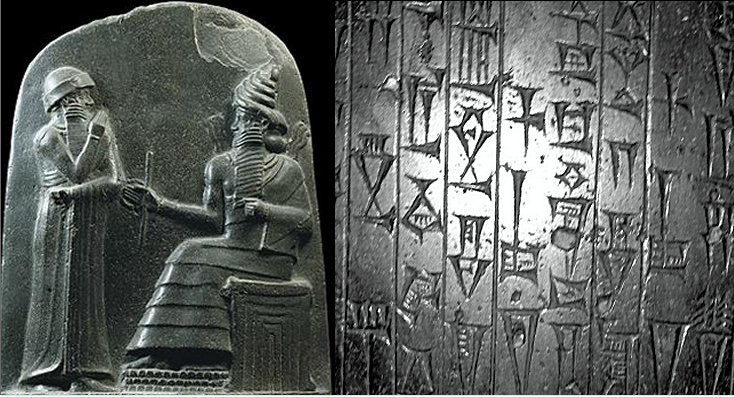
The image size is (734, 398). I want to click on something you sit on, so click(271, 311).